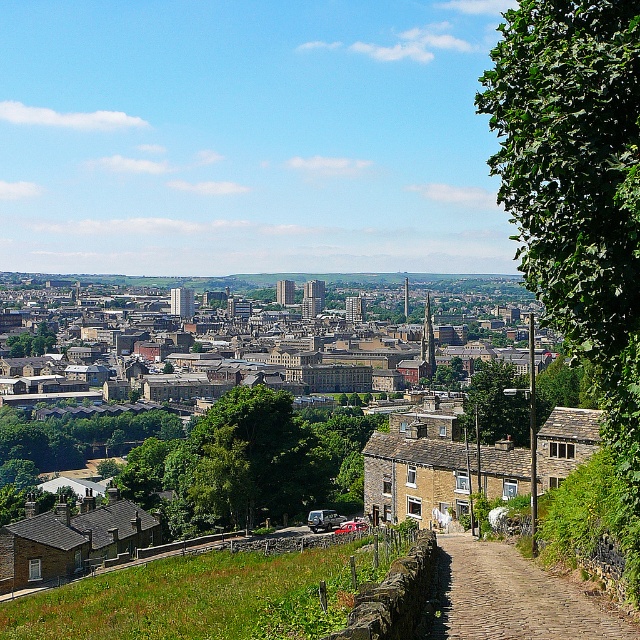
You are a hiker standing on the grassy slope and want to take a photo of the green leafy tree at right and the brown cobblestone path at lower right. Which object is wider in the image?

The green leafy tree at right might be wider than brown cobblestone path at lower right according to the description.

You are standing at the center of the image and want to locate the green leafy tree at right. According to the coordinates provided, in which direction should you look to find it?

The green leafy tree at right is located at coordinates point (579, 196). Since you are at the center, looking to the right would align with the tree at the specified coordinates.